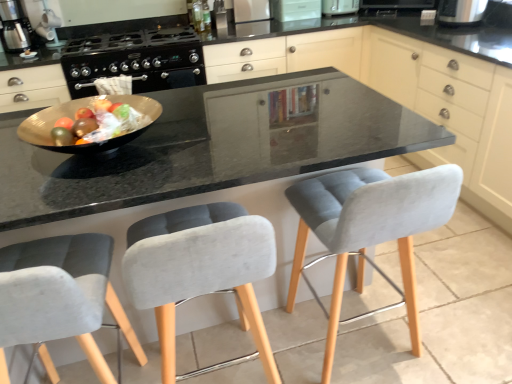
How much space does velvet grey chair at lower left, which is the 1th chair in left-to-right order, occupy vertically?

It is 91.44 centimeters.

Locate an element on the screen. The image size is (512, 384). white glossy microwave at upper center, placed as the 3th appliance when sorted from left to right is located at coordinates (295, 9).

Locate an element on the screen. This screenshot has height=384, width=512. metallic silver coffee maker at upper left is located at coordinates (14, 27).

You are a GUI agent. You are given a task and a screenshot of the screen. Output one action in this format:
    pyautogui.click(x=<x>, y=<y>)
    Task: Click on the matte gray cabinet at center, which ranks as the 1th cabinetry in left-to-right order
    The image size is (512, 384).
    Given the screenshot: What is the action you would take?
    pyautogui.click(x=410, y=97)

In the image, is metallic silver coffee maker at upper left positioned in front of or behind metallic silver toaster at upper center, which is the first appliance from left to right?

metallic silver coffee maker at upper left is in front of metallic silver toaster at upper center, which is the first appliance from left to right.

Is metallic silver coffee maker at upper left oriented away from metallic silver toaster at upper center, which is the first appliance from left to right?

metallic silver coffee maker at upper left does not have its back to metallic silver toaster at upper center, which is the first appliance from left to right.

Between metallic silver coffee maker at upper left and metallic silver toaster at upper center, which is the first appliance from left to right, which one has smaller width?

metallic silver coffee maker at upper left is thinner.

From the image's perspective, which one is positioned higher, metallic silver coffee maker at upper left or metallic silver toaster at upper center, which is the 5th appliance from right to left?

From the image's view, metallic silver toaster at upper center, which is the 5th appliance from right to left, is above.

Is white plastic toaster at upper center, which ranks as the 4th appliance in left-to-right order, further to the viewer compared to shiny gold bowl at center?

Yes.

From the image's perspective, does white plastic toaster at upper center, placed as the 2th appliance when sorted from right to left, appear higher than shiny gold bowl at center?

Yes, from the image's perspective, white plastic toaster at upper center, placed as the 2th appliance when sorted from right to left, is on top of shiny gold bowl at center.

Is white plastic toaster at upper center, placed as the 2th appliance when sorted from right to left, situated inside shiny gold bowl at center or outside?

white plastic toaster at upper center, placed as the 2th appliance when sorted from right to left, cannot be found inside shiny gold bowl at center.

Identify the location of bowl that appears on the left of white plastic toaster at upper center, which ranks as the 4th appliance in left-to-right order. The height and width of the screenshot is (384, 512). (53, 125).

From a real-world perspective, between matte gray cabinet at center, which ranks as the 1th cabinetry in left-to-right order, and velvet grey chair at center, placed as the 1th chair when sorted from right to left, who is vertically lower?

matte gray cabinet at center, which ranks as the 1th cabinetry in left-to-right order.

Is matte gray cabinet at center, which ranks as the 1th cabinetry in left-to-right order, positioned beyond the bounds of velvet grey chair at center, placed as the 1th chair when sorted from right to left?

Yes, matte gray cabinet at center, which ranks as the 1th cabinetry in left-to-right order, is located beyond the bounds of velvet grey chair at center, placed as the 1th chair when sorted from right to left.

Is velvet grey chair at center, placed as the 1th chair when sorted from right to left, at the back of matte gray cabinet at center, which ranks as the 1th cabinetry in left-to-right order?

That's not correct — matte gray cabinet at center, which ranks as the 1th cabinetry in left-to-right order, is not looking away from velvet grey chair at center, placed as the 1th chair when sorted from right to left.

Does matte gray cabinet at center, which ranks as the 1th cabinetry in left-to-right order, touch velvet grey chair at center, which is the 3th chair in left-to-right order?

No, matte gray cabinet at center, which ranks as the 1th cabinetry in left-to-right order, is not in contact with velvet grey chair at center, which is the 3th chair in left-to-right order.

Is matte gray cabinet at center, which ranks as the 1th cabinetry in left-to-right order, surrounding satin silver refrigerator at upper center, positioned as the fourth appliance in right-to-left order?

That's incorrect, satin silver refrigerator at upper center, positioned as the fourth appliance in right-to-left order, is not inside matte gray cabinet at center, which ranks as the 1th cabinetry in left-to-right order.

Is matte gray cabinet at center, which ranks as the 1th cabinetry in left-to-right order, taller or shorter than satin silver refrigerator at upper center, which is the second appliance in left-to-right order?

Clearly, matte gray cabinet at center, which ranks as the 1th cabinetry in left-to-right order, is taller compared to satin silver refrigerator at upper center, which is the second appliance in left-to-right order.

From the image's perspective, which one is positioned higher, matte gray cabinet at center, arranged as the 2th cabinetry when viewed from the right, or satin silver refrigerator at upper center, positioned as the fourth appliance in right-to-left order?

satin silver refrigerator at upper center, positioned as the fourth appliance in right-to-left order.

This screenshot has width=512, height=384. What are the coordinates of `bowl that appears on the left of white plastic toaster at upper center, which ranks as the 4th appliance in left-to-right order` in the screenshot? It's located at (53, 125).

Which is more distant, (132, 133) or (350, 6)?

The point (350, 6) is farther from the camera.

Would you say shiny gold bowl at center is inside or outside white plastic toaster at upper center, placed as the 2th appliance when sorted from right to left?

The correct answer is: outside.

From their relative heights in the image, would you say velvet grey chair at center, placed as the 1th chair when sorted from right to left, is taller or shorter than velvet grey chair at center, the 2th chair positioned from the right?

velvet grey chair at center, placed as the 1th chair when sorted from right to left, is taller than velvet grey chair at center, the 2th chair positioned from the right.

Can you tell me how much velvet grey chair at center, which is the 3th chair in left-to-right order, and velvet grey chair at center, the 2th chair positioned from the right, differ in facing direction?

They differ by 1.7 degrees in their facing directions.

From a real-world perspective, between velvet grey chair at center, placed as the 1th chair when sorted from right to left, and velvet grey chair at center, which is counted as the 2th chair, starting from the left, who is vertically higher?

velvet grey chair at center, placed as the 1th chair when sorted from right to left, is physically above.

Does velvet grey chair at center, which is the 3th chair in left-to-right order, appear on the right side of velvet grey chair at center, the 2th chair positioned from the right?

Yes.

Can you tell me how much white glossy microwave at upper center, placed as the 3th appliance when sorted from left to right, and matte gray cabinet at center, arranged as the 2th cabinetry when viewed from the right, differ in facing direction?

89.7 degrees.

From a real-world perspective, between white glossy microwave at upper center, placed as the 3th appliance when sorted from left to right, and matte gray cabinet at center, arranged as the 2th cabinetry when viewed from the right, who is vertically higher?

white glossy microwave at upper center, placed as the 3th appliance when sorted from left to right.

Is the position of white glossy microwave at upper center, placed as the 3th appliance when sorted from left to right, less distant than that of matte gray cabinet at center, arranged as the 2th cabinetry when viewed from the right?

No, white glossy microwave at upper center, placed as the 3th appliance when sorted from left to right, is further to the viewer.

Can matte gray cabinet at center, arranged as the 2th cabinetry when viewed from the right, be found inside white glossy microwave at upper center, which appears as the 3th appliance when viewed from the right?

Definitely not — matte gray cabinet at center, arranged as the 2th cabinetry when viewed from the right, is not inside white glossy microwave at upper center, which appears as the 3th appliance when viewed from the right.

Locate an element on the screen. the 1st appliance to the right when counting from the metallic silver coffee maker at upper left is located at coordinates point(221,14).

In the image, there is a white plastic toaster at upper center, which ranks as the 4th appliance in left-to-right order. Where is `bowl below it (from the image's perspective)`? The width and height of the screenshot is (512, 384). bowl below it (from the image's perspective) is located at coordinates (53, 125).

Looking at the image, which one is located further to white plastic toaster at upper center, placed as the 2th appliance when sorted from right to left, metallic silver toaster at upper center, which is the 5th appliance from right to left, or white glossy microwave at upper center, placed as the 3th appliance when sorted from left to right?

metallic silver toaster at upper center, which is the 5th appliance from right to left.

When comparing their distances from velvet grey chair at center, placed as the 1th chair when sorted from right to left, does metallic silver coffee maker at upper left or metallic silver toaster at upper center, which is the 5th appliance from right to left, seem closer?

metallic silver toaster at upper center, which is the 5th appliance from right to left.

From the image, which object appears to be farther from white plastic toaster at upper center, placed as the 2th appliance when sorted from right to left, velvet grey chair at center, the 2th chair positioned from the right, or metallic silver coffee maker at upper left?

velvet grey chair at center, the 2th chair positioned from the right.

Looking at the image, which one is located closer to black plastic toaster at upper right, the fifth appliance positioned from the left, velvet grey chair at lower left, the 3th chair from the right, or white glossy microwave at upper center, placed as the 3th appliance when sorted from left to right?

Among the two, white glossy microwave at upper center, placed as the 3th appliance when sorted from left to right, is located nearer to black plastic toaster at upper right, the fifth appliance positioned from the left.

Based on their spatial positions, is matte gray cabinet at center, arranged as the 2th cabinetry when viewed from the right, or white plastic toaster at upper center, which ranks as the 4th appliance in left-to-right order, further from velvet grey chair at center, placed as the 1th chair when sorted from right to left?

white plastic toaster at upper center, which ranks as the 4th appliance in left-to-right order, is positioned further to the anchor velvet grey chair at center, placed as the 1th chair when sorted from right to left.

Based on their spatial positions, is matte gray cabinet at center, which ranks as the 1th cabinetry in left-to-right order, or matte white cabinet at upper right, the 2th cabinetry in the left-to-right sequence, closer to white glossy microwave at upper center, placed as the 3th appliance when sorted from left to right?

matte gray cabinet at center, which ranks as the 1th cabinetry in left-to-right order, is closer to white glossy microwave at upper center, placed as the 3th appliance when sorted from left to right.

From the image, which object appears to be nearer to white plastic toaster at upper center, which ranks as the 4th appliance in left-to-right order, satin silver refrigerator at upper center, which is the second appliance in left-to-right order, or matte gray cabinet at center, which ranks as the 1th cabinetry in left-to-right order?

satin silver refrigerator at upper center, which is the second appliance in left-to-right order, is positioned closer to the anchor white plastic toaster at upper center, which ranks as the 4th appliance in left-to-right order.

Considering their positions, is matte white cabinet at upper right, the 2th cabinetry in the left-to-right sequence, positioned closer to velvet grey chair at center, which is the 3th chair in left-to-right order, than white glossy microwave at upper center, placed as the 3th appliance when sorted from left to right?

matte white cabinet at upper right, the 2th cabinetry in the left-to-right sequence, lies closer to velvet grey chair at center, which is the 3th chair in left-to-right order, than the other object.

The image size is (512, 384). I want to click on kitchen appliance between velvet grey chair at center, the 2th chair positioned from the right, and metallic silver toaster at upper center, which is the 5th appliance from right to left, along the z-axis, so click(14, 27).

Find the location of a particular element. appliance between metallic silver toaster at upper center, which is the first appliance from left to right, and white glossy microwave at upper center, which appears as the 3th appliance when viewed from the right, from left to right is located at coordinates (251, 10).

In order to click on chair between velvet grey chair at lower left, which is the 1th chair in left-to-right order, and velvet grey chair at center, placed as the 1th chair when sorted from right to left, in the horizontal direction in this screenshot , I will do `click(200, 271)`.

Locate an element on the screen. This screenshot has height=384, width=512. cabinetry between metallic silver coffee maker at upper left and matte white cabinet at upper right, the 2th cabinetry in the left-to-right sequence, from left to right is located at coordinates (410, 97).